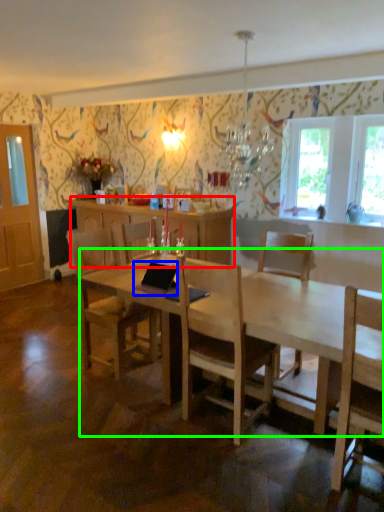
Question: Estimate the real-world distances between objects in this image. Which object is farther from cabinetry (highlighted by a red box), laptop (highlighted by a blue box) or desk (highlighted by a green box)?

Choices:
 (A) laptop
 (B) desk

Answer: (B)